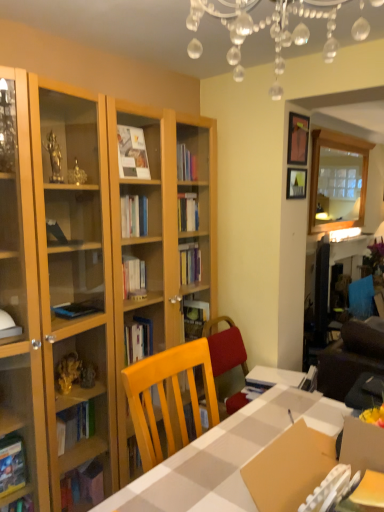
Question: Is clear glass mirror at upper right looking in the opposite direction of wooden picture frame at upper right, placed as the first picture frame when sorted from bottom to top?

Choices:
 (A) no
 (B) yes

Answer: (A)

Question: Is clear glass mirror at upper right oriented towards wooden picture frame at upper right, placed as the first picture frame when sorted from bottom to top?

Choices:
 (A) yes
 (B) no

Answer: (B)

Question: From a real-world perspective, is clear glass mirror at upper right over wooden picture frame at upper right, placed as the first picture frame when sorted from bottom to top?

Choices:
 (A) no
 (B) yes

Answer: (B)

Question: Is clear glass mirror at upper right outside of wooden picture frame at upper right, placed as the first picture frame when sorted from bottom to top?

Choices:
 (A) no
 (B) yes

Answer: (B)

Question: Would you say clear glass mirror at upper right is a long distance from wooden picture frame at upper right, the 2th picture frame when ordered from top to bottom?

Choices:
 (A) yes
 (B) no

Answer: (A)

Question: Considering the positions of white checkered table at center and matte black picture frame at upper right, marked as the first picture frame in a top-to-bottom arrangement, in the image, is white checkered table at center taller or shorter than matte black picture frame at upper right, marked as the first picture frame in a top-to-bottom arrangement,?

Choices:
 (A) tall
 (B) short

Answer: (A)

Question: Considering the positions of white checkered table at center and matte black picture frame at upper right, marked as the first picture frame in a top-to-bottom arrangement, in the image, is white checkered table at center wider or thinner than matte black picture frame at upper right, marked as the first picture frame in a top-to-bottom arrangement,?

Choices:
 (A) wide
 (B) thin

Answer: (A)

Question: Is white checkered table at center bigger or smaller than matte black picture frame at upper right, which ranks as the second picture frame in bottom-to-top order?

Choices:
 (A) big
 (B) small

Answer: (A)

Question: In the image, is white checkered table at center on the left side or the right side of matte black picture frame at upper right, which ranks as the second picture frame in bottom-to-top order?

Choices:
 (A) left
 (B) right

Answer: (A)

Question: Do you think clear crystal chandelier at upper center is within white checkered table at center, or outside of it?

Choices:
 (A) inside
 (B) outside

Answer: (B)

Question: Looking at their shapes, would you say clear crystal chandelier at upper center is wider or thinner than white checkered table at center?

Choices:
 (A) wide
 (B) thin

Answer: (A)

Question: Is point (281, 11) positioned closer to the camera than point (167, 504)?

Choices:
 (A) closer
 (B) farther

Answer: (A)

Question: In the image, is clear crystal chandelier at upper center on the left side or the right side of white checkered table at center?

Choices:
 (A) left
 (B) right

Answer: (A)

Question: Considering the relative positions of matte black picture frame at upper right, which ranks as the second picture frame in bottom-to-top order, and clear crystal chandelier at upper center in the image provided, is matte black picture frame at upper right, which ranks as the second picture frame in bottom-to-top order, to the left or to the right of clear crystal chandelier at upper center?

Choices:
 (A) right
 (B) left

Answer: (A)

Question: In terms of size, does matte black picture frame at upper right, marked as the first picture frame in a top-to-bottom arrangement, appear bigger or smaller than clear crystal chandelier at upper center?

Choices:
 (A) big
 (B) small

Answer: (B)